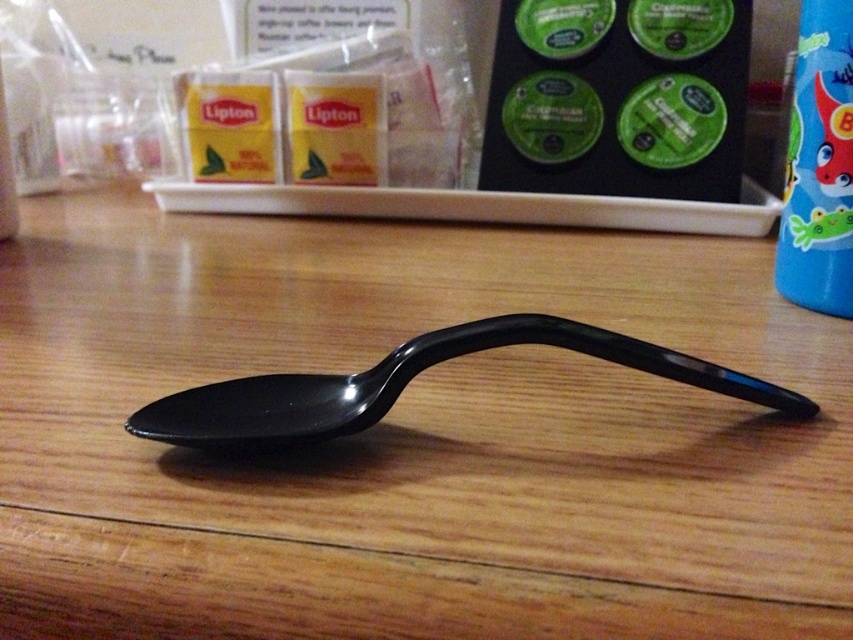
Question: Which point is farther to the camera?

Choices:
 (A) (199, 218)
 (B) (393, 372)

Answer: (A)

Question: Does black glossy spoon at center come in front of blue glossy bottle at right?

Choices:
 (A) no
 (B) yes

Answer: (B)

Question: Based on their relative distances, which object is farther from the black glossy spoon at center?

Choices:
 (A) wooden table at center
 (B) blue glossy bottle at right

Answer: (B)

Question: Can you confirm if wooden table at center is positioned above blue glossy bottle at right?

Choices:
 (A) no
 (B) yes

Answer: (A)

Question: In this image, where is wooden table at center located relative to black glossy spoon at center?

Choices:
 (A) below
 (B) above

Answer: (B)

Question: Which of the following is the farthest from the observer?

Choices:
 (A) (463, 467)
 (B) (242, 442)

Answer: (A)